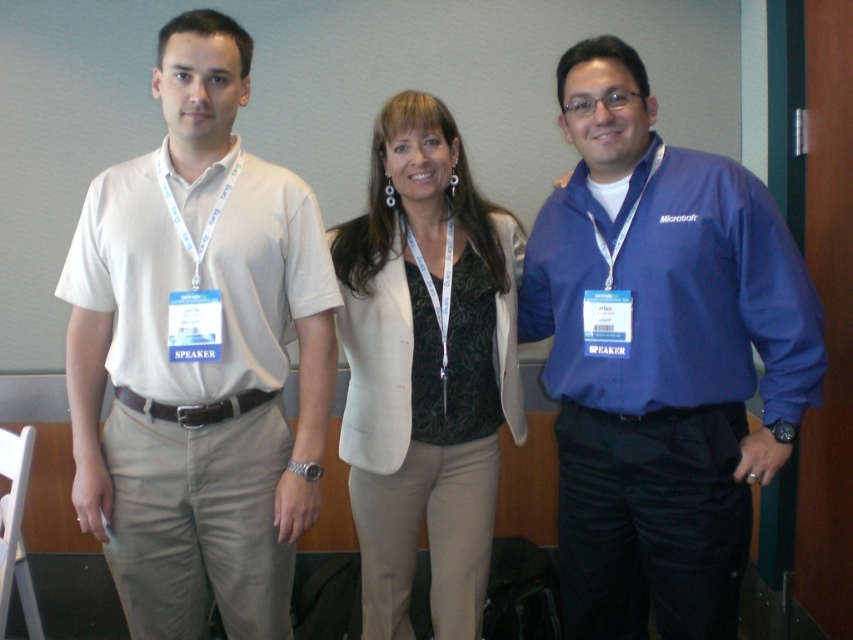
Question: Among these objects, which one is nearest to the camera?

Choices:
 (A) matte white shirt at left
 (B) matte white blazer at center

Answer: (A)

Question: Does matte white shirt at left appear on the right side of blue fabric shirt at right?

Choices:
 (A) no
 (B) yes

Answer: (A)

Question: Which point is farther to the camera?

Choices:
 (A) (627, 214)
 (B) (404, 204)

Answer: (B)

Question: Is blue fabric shirt at right to the right of matte white blazer at center from the viewer's perspective?

Choices:
 (A) yes
 (B) no

Answer: (A)

Question: Is matte white shirt at left to the right of matte white blazer at center from the viewer's perspective?

Choices:
 (A) no
 (B) yes

Answer: (A)

Question: Which object appears closest to the camera in this image?

Choices:
 (A) matte white shirt at left
 (B) blue fabric shirt at right

Answer: (A)